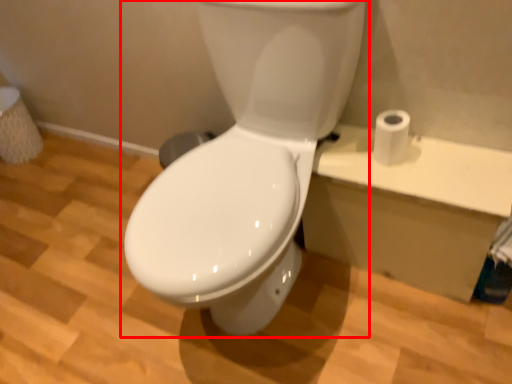
Question: From the image's perspective, what is the correct spatial relationship of toilet (annotated by the red box) in relation to toilet paper?

Choices:
 (A) above
 (B) below

Answer: (B)